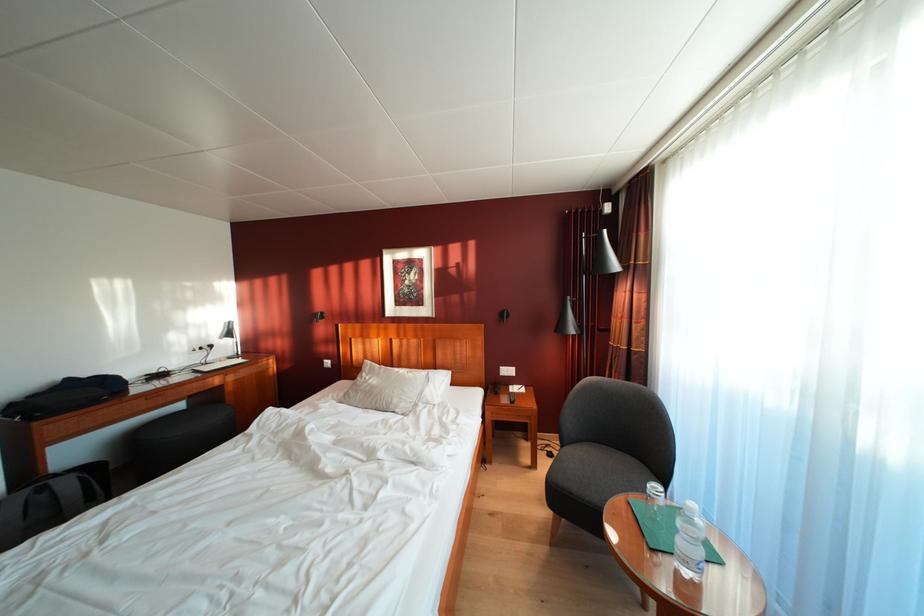
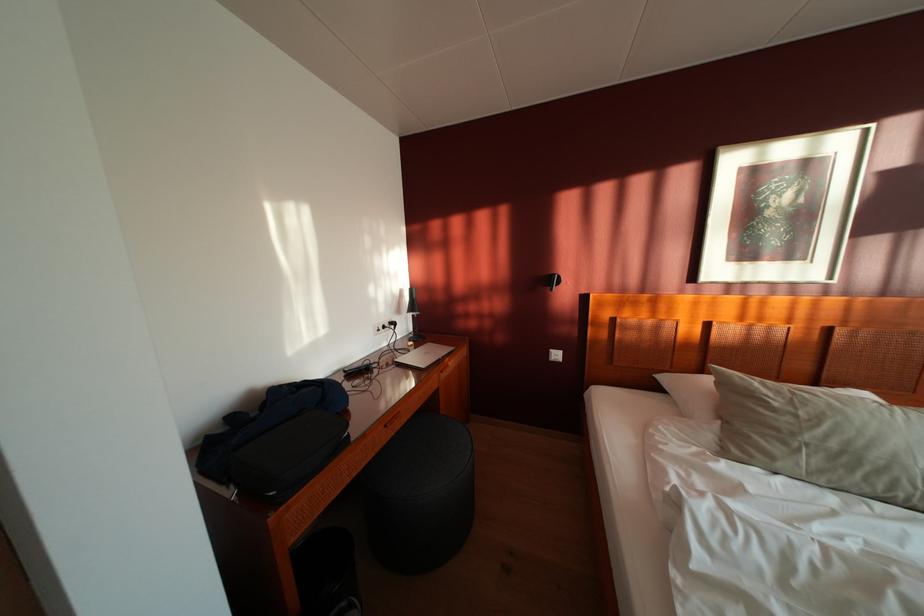
The point at [331,369] is marked in the first image. Where is the corresponding point in the second image?

(555, 360)